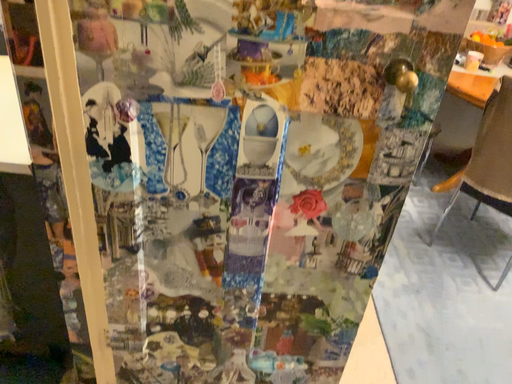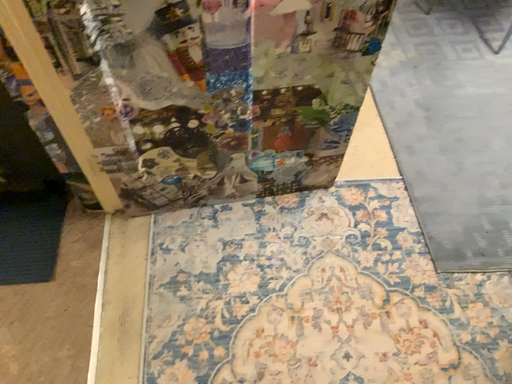
Question: How did the camera likely rotate when shooting the video?

Choices:
 (A) rotated upward
 (B) rotated downward

Answer: (B)